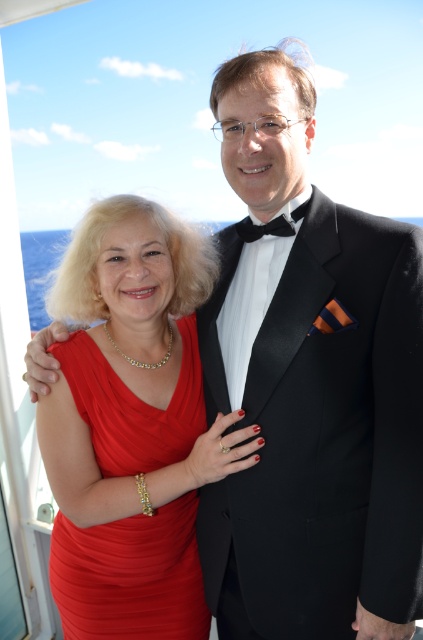
Question: Which object is farther from the camera taking this photo?

Choices:
 (A) black satin bow tie at center
 (B) shiny red dress at center

Answer: (B)

Question: Does shiny red dress at center have a larger size compared to black satin bow tie at upper center?

Choices:
 (A) yes
 (B) no

Answer: (A)

Question: Which is farther from the black satin bow tie at center?

Choices:
 (A) shiny red dress at center
 (B) black satin bow tie at upper center

Answer: (A)

Question: Estimate the real-world distances between objects in this image. Which object is closer to the shiny red dress at center?

Choices:
 (A) black satin bow tie at upper center
 (B) black satin bow tie at center

Answer: (B)

Question: Is black satin bow tie at center to the right of black satin bow tie at upper center from the viewer's perspective?

Choices:
 (A) yes
 (B) no

Answer: (A)

Question: Can you confirm if shiny red dress at center is positioned above black satin bow tie at upper center?

Choices:
 (A) no
 (B) yes

Answer: (A)